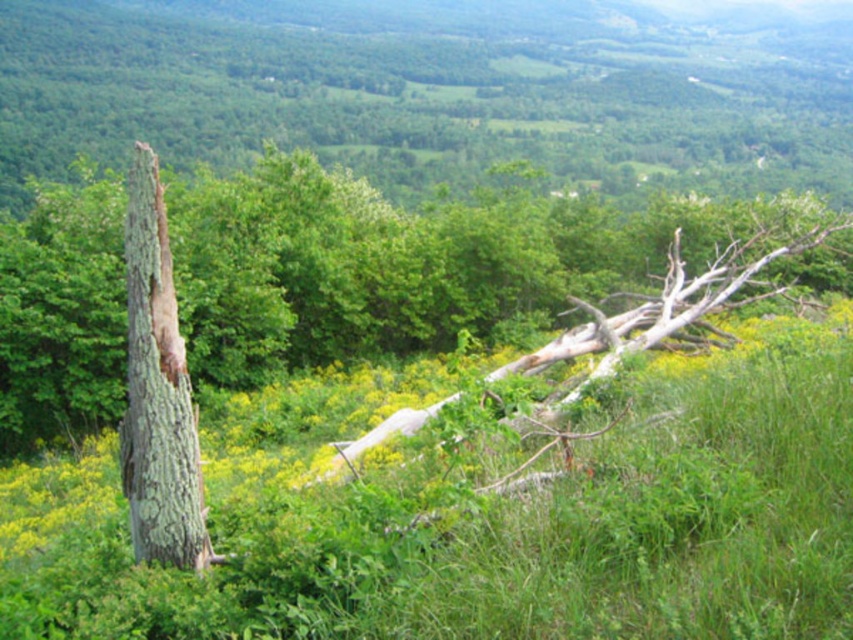
Question: Which is farther from the greenish-brown bark tree trunk at left?

Choices:
 (A) green grassy at center
 (B) smooth bark tree trunk at left

Answer: (B)

Question: Which point appears farthest from the camera in this image?

Choices:
 (A) (778, 637)
 (B) (746, 208)
 (C) (132, 298)

Answer: (B)

Question: Is green grassy at center smaller than greenish-brown bark tree trunk at left?

Choices:
 (A) yes
 (B) no

Answer: (B)

Question: Does green grassy at center have a smaller size compared to smooth bark tree trunk at left?

Choices:
 (A) no
 (B) yes

Answer: (B)

Question: Which of the following is the closest to the observer?

Choices:
 (A) pyautogui.click(x=331, y=637)
 (B) pyautogui.click(x=281, y=252)

Answer: (A)

Question: Can you confirm if green grassy at center is positioned to the right of smooth bark tree trunk at left?

Choices:
 (A) no
 (B) yes

Answer: (B)